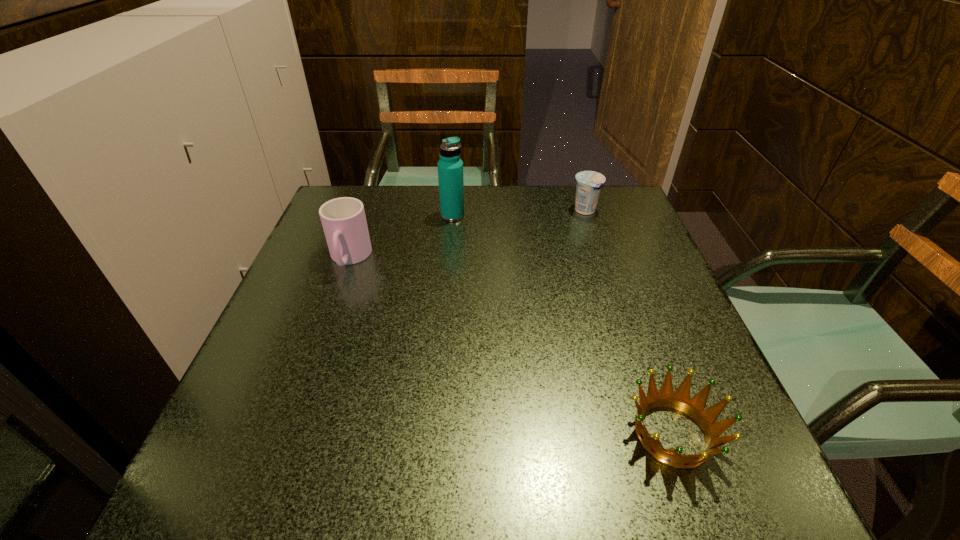
At what (x,y) coordinates should I click in order to perform the action: click on vacant space at the near edge of the desktop. Please return your answer as a coordinate pair (x, y). Looking at the image, I should click on (533, 492).

In the image, there is a desktop. At what (x,y) coordinates should I click in order to perform the action: click on free space at the left edge. Please return your answer as a coordinate pair (x, y). Looking at the image, I should click on (339, 351).

Image resolution: width=960 pixels, height=540 pixels. What are the coordinates of `free space at the right edge of the desktop` in the screenshot? It's located at (625, 274).

Identify the location of blank area at the far left corner. (378, 197).

Find the location of `vacant region at the far right corner of the desktop`. vacant region at the far right corner of the desktop is located at coordinates (612, 225).

Where is `empty location between the yogurt and the tallest object`? The height and width of the screenshot is (540, 960). empty location between the yogurt and the tallest object is located at coordinates (519, 213).

Where is `empty space between the cup and the third tallest object`? empty space between the cup and the third tallest object is located at coordinates (468, 235).

Image resolution: width=960 pixels, height=540 pixels. Find the location of `vacant area that lies between the nearest object and the cup`. vacant area that lies between the nearest object and the cup is located at coordinates (511, 346).

Find the location of a particular element. free space between the water bottle and the second tallest object is located at coordinates (401, 237).

You are a GUI agent. You are given a task and a screenshot of the screen. Output one action in this format:
    pyautogui.click(x=<x>, y=<y>)
    Task: Click on the free space between the cup and the yogurt
    This screenshot has width=960, height=540.
    Given the screenshot: What is the action you would take?
    pyautogui.click(x=468, y=235)